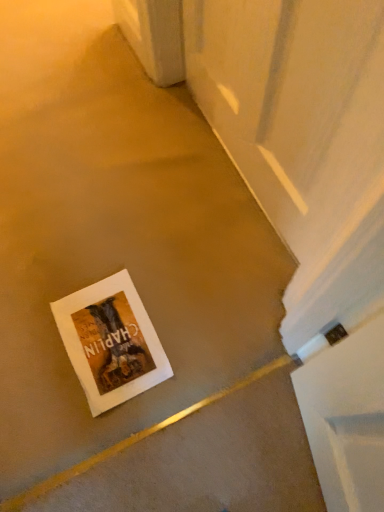
In order to face white paper at lower left, should I rotate leftwards or rightwards?

Turn left approximately 11.068 degrees to face it.

You are a GUI agent. You are given a task and a screenshot of the screen. Output one action in this format:
    pyautogui.click(x=<x>, y=<y>)
    Task: Click on the white paper at lower left
    The image size is (384, 512).
    Given the screenshot: What is the action you would take?
    pyautogui.click(x=111, y=342)

What do you see at coordinates (111, 342) in the screenshot?
I see `white paper at lower left` at bounding box center [111, 342].

The height and width of the screenshot is (512, 384). Find the location of `white paper at lower left`. white paper at lower left is located at coordinates (111, 342).